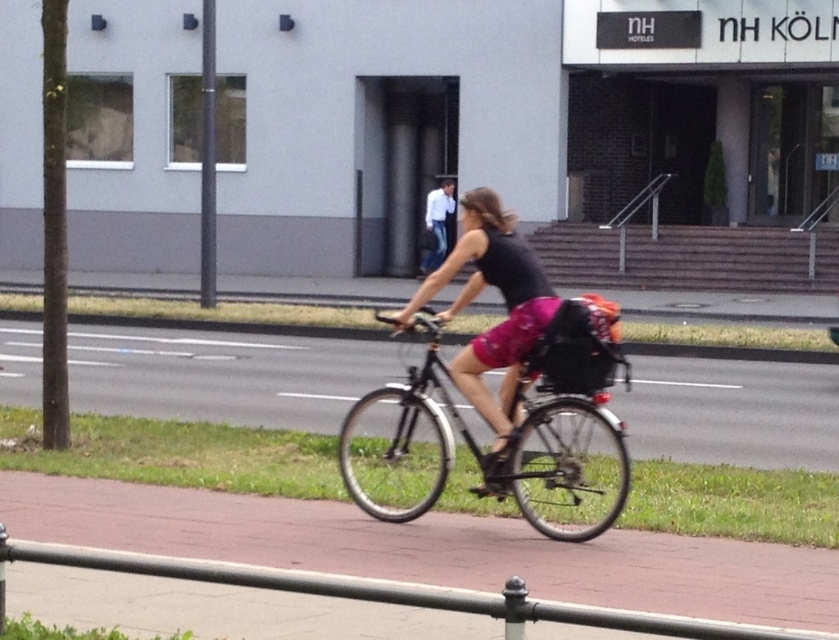
You are a delivery person who needs to park your shiny black bicycle at center near the black metal rail at lower center. Considering their widths, will your bicycle fit alongside the rail without overlapping?

The shiny black bicycle at center has a lesser width compared to the black metal rail at lower center, so yes, the bicycle can be parked alongside the rail without overlapping since it is narrower.

You are standing at the camera position and want to reach the point marked at coordinates (x=603, y=529). If you walk directly towards it, how far will you have to walk in feet?

The point marked at coordinates (x=603, y=529) is 30.27 feet away from the camera, so you will have to walk 30.27 feet to reach it.

Consider the image. You are a delivery person who needs to attach a package to your shiny black bicycle at center. The package must be placed above the white cotton shirt at center. Is this possible given their positions?

The shiny black bicycle at center is located below the white cotton shirt at center, so placing the package above the white cotton shirt at center would also position it above the bicycle, making it feasible.